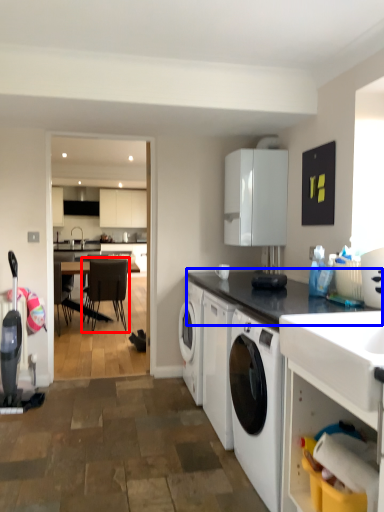
Question: Which object is further to the camera taking this photo, chair (highlighted by a red box) or countertop (highlighted by a blue box)?

Choices:
 (A) chair
 (B) countertop

Answer: (A)